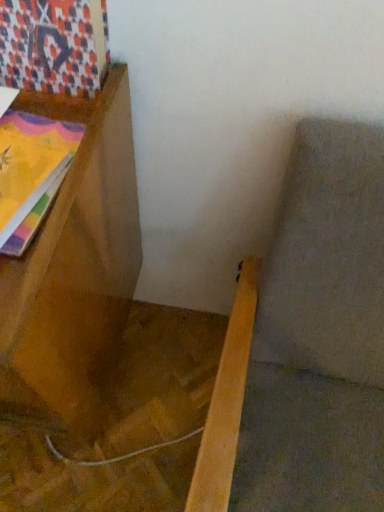
Question: From a real-world perspective, is wooden bookshelf at left physically above patterned fabric at upper left?

Choices:
 (A) no
 (B) yes

Answer: (A)

Question: Is wooden bookshelf at left beside patterned fabric at upper left?

Choices:
 (A) yes
 (B) no

Answer: (B)

Question: Does wooden bookshelf at left have a lesser height compared to patterned fabric at upper left?

Choices:
 (A) no
 (B) yes

Answer: (A)

Question: Is wooden bookshelf at left aimed at patterned fabric at upper left?

Choices:
 (A) yes
 (B) no

Answer: (B)

Question: Considering the relative sizes of wooden bookshelf at left and patterned fabric at upper left in the image provided, is wooden bookshelf at left thinner than patterned fabric at upper left?

Choices:
 (A) no
 (B) yes

Answer: (A)

Question: Is patterned fabric at upper left inside wooden bookshelf at left?

Choices:
 (A) yes
 (B) no

Answer: (B)

Question: Is patterned fabric at upper left looking in the opposite direction of wooden bookshelf at left?

Choices:
 (A) yes
 (B) no

Answer: (B)

Question: Does patterned fabric at upper left have a greater width compared to wooden bookshelf at left?

Choices:
 (A) yes
 (B) no

Answer: (B)

Question: From the image's perspective, is patterned fabric at upper left below wooden bookshelf at left?

Choices:
 (A) yes
 (B) no

Answer: (B)

Question: Considering the relative sizes of patterned fabric at upper left and wooden bookshelf at left in the image provided, is patterned fabric at upper left smaller than wooden bookshelf at left?

Choices:
 (A) no
 (B) yes

Answer: (B)

Question: Is patterned fabric at upper left at the left side of wooden bookshelf at left?

Choices:
 (A) no
 (B) yes

Answer: (A)

Question: Is patterned fabric at upper left not inside wooden bookshelf at left?

Choices:
 (A) no
 (B) yes

Answer: (B)

Question: Looking at the image, does wooden bookshelf at left seem bigger or smaller compared to patterned fabric at upper left?

Choices:
 (A) big
 (B) small

Answer: (A)